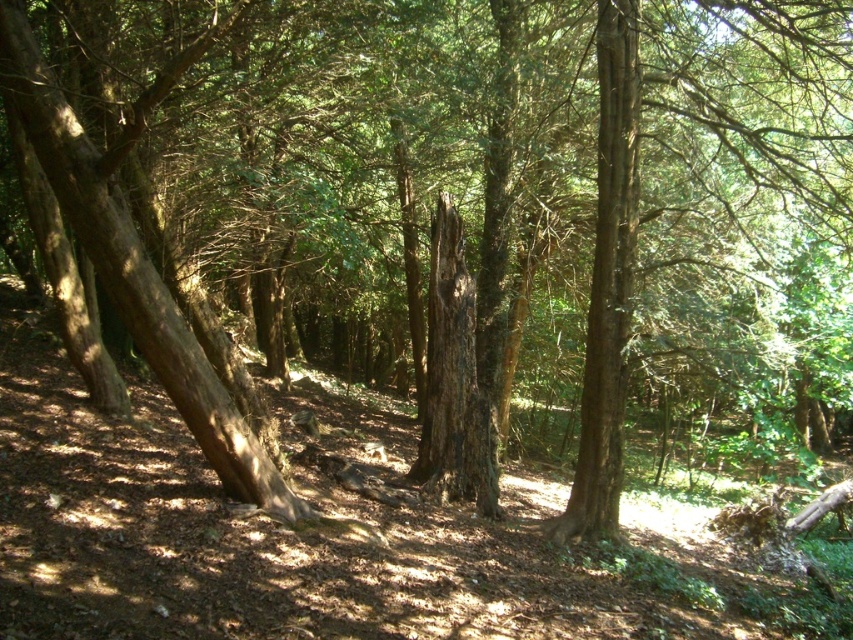
Does brown rough bark tree trunk at center appear under dark brown rough bark tree trunk at center?

No.

Can you confirm if brown rough bark tree trunk at center is smaller than dark brown rough bark tree trunk at center?

Actually, brown rough bark tree trunk at center might be larger than dark brown rough bark tree trunk at center.

Describe the element at coordinates (607, 282) in the screenshot. I see `brown rough bark tree trunk at center` at that location.

Where is `brown rough bark tree trunk at center`? brown rough bark tree trunk at center is located at coordinates (607, 282).

Is brown rough tree trunk at left smaller than brown rough bark tree trunk at center?

No, brown rough tree trunk at left is not smaller than brown rough bark tree trunk at center.

Does point (219, 436) come in front of point (624, 380)?

Yes, it is in front of point (624, 380).

Find the location of a particular element. The height and width of the screenshot is (640, 853). brown rough tree trunk at left is located at coordinates (136, 259).

Is point (136, 305) farther from camera compared to point (456, 248)?

No, (136, 305) is closer to viewer.

Where is `brown rough tree trunk at left`? The width and height of the screenshot is (853, 640). brown rough tree trunk at left is located at coordinates (136, 259).

Where is `brown rough tree trunk at left`? This screenshot has width=853, height=640. brown rough tree trunk at left is located at coordinates (136, 259).